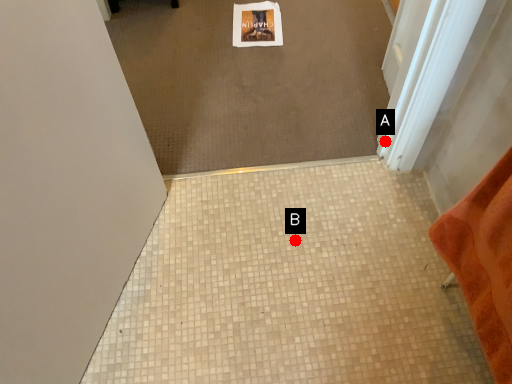
Question: Two points are circled on the image, labeled by A and B beside each circle. Which of the following is the closest to the observer?

Choices:
 (A) A is closer
 (B) B is closer

Answer: (B)